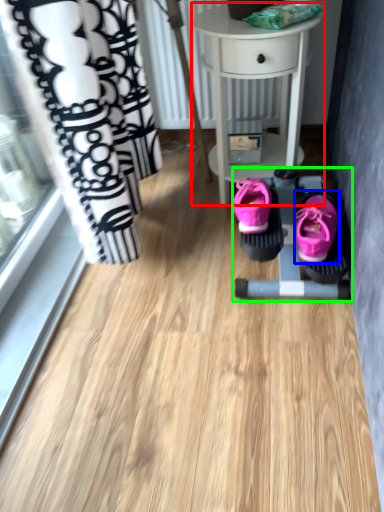
Question: Estimate the real-world distances between objects in this image. Which object is farther from table (highlighted by a red box), footwear (highlighted by a blue box) or baby carriage (highlighted by a green box)?

Choices:
 (A) footwear
 (B) baby carriage

Answer: (A)